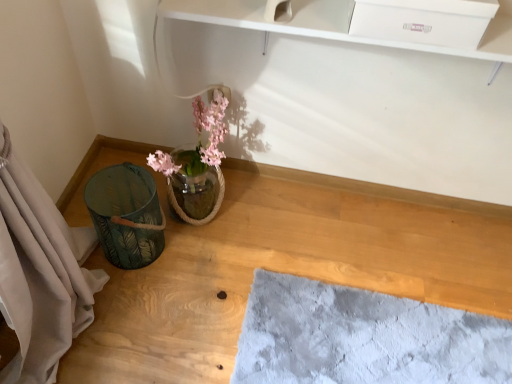
Question: From a real-world perspective, is green fabric basket at lower left positioned above or below green leaf-patterned basket at left?

Choices:
 (A) above
 (B) below

Answer: (B)

Question: From the image's perspective, is green fabric basket at lower left positioned above or below green leaf-patterned basket at left?

Choices:
 (A) above
 (B) below

Answer: (B)

Question: Estimate the real-world distances between objects in this image. Which object is closer to the translucent glass vase at center?

Choices:
 (A) green fabric basket at lower left
 (B) white glossy drawer at upper center
 (C) green leaf-patterned basket at left

Answer: (C)

Question: Which object is positioned closest to the green leaf-patterned basket at left?

Choices:
 (A) translucent glass vase at center
 (B) green fabric basket at lower left
 (C) white glossy drawer at upper center

Answer: (A)